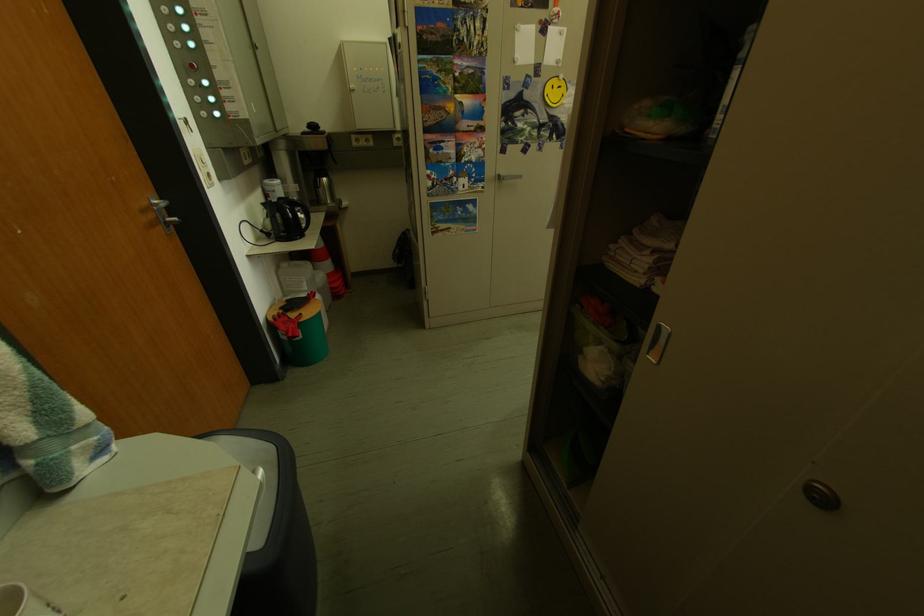
The height and width of the screenshot is (616, 924). What do you see at coordinates (327, 269) in the screenshot? I see `the red glove` at bounding box center [327, 269].